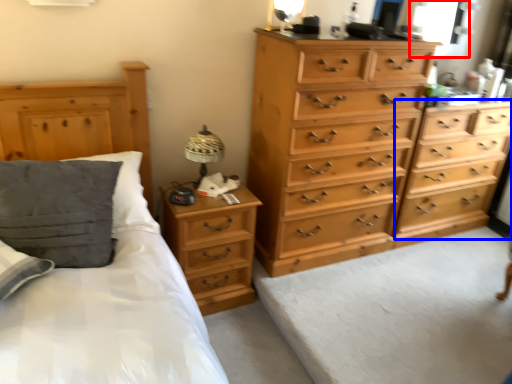
Question: Which object appears closest to the camera in this image, window (highlighted by a red box) or chest of drawers (highlighted by a blue box)?

Choices:
 (A) window
 (B) chest of drawers

Answer: (B)